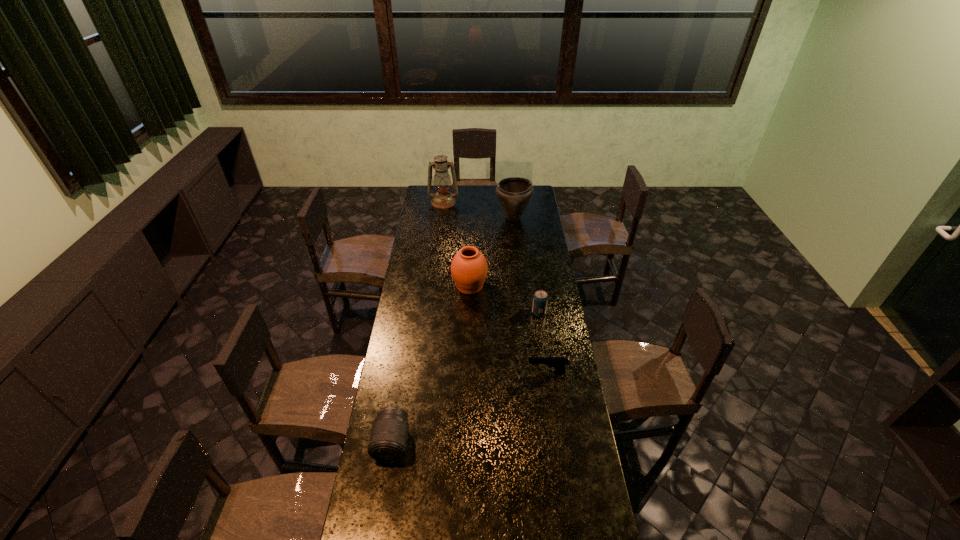
The height and width of the screenshot is (540, 960). Identify the location of pop soda that is at the right edge. (540, 299).

Where is `pistol located in the right edge section of the desktop`? pistol located in the right edge section of the desktop is located at coordinates (559, 363).

The image size is (960, 540). I want to click on object positioned at the far left corner, so click(443, 199).

You are a GUI agent. You are given a task and a screenshot of the screen. Output one action in this format:
    pyautogui.click(x=<x>, y=<y>)
    Task: Click on the vacant space at the far edge
    The image size is (960, 540).
    Given the screenshot: What is the action you would take?
    pyautogui.click(x=484, y=194)

The height and width of the screenshot is (540, 960). Identify the location of vacant area at the left edge of the desktop. (381, 408).

Find the location of `free space at the right edge of the desktop`. free space at the right edge of the desktop is located at coordinates (537, 210).

Where is `vacant space in between the tallest object and the nearest object`? vacant space in between the tallest object and the nearest object is located at coordinates (418, 322).

Where is `blank region between the second nearest object and the fourth nearest object`? This screenshot has height=540, width=960. blank region between the second nearest object and the fourth nearest object is located at coordinates (509, 329).

You are a GUI agent. You are given a task and a screenshot of the screen. Output one action in this format:
    pyautogui.click(x=<x>, y=<y>)
    Task: Click on the free space between the farther urn and the third farthest object
    The height and width of the screenshot is (540, 960).
    Given the screenshot: What is the action you would take?
    pyautogui.click(x=492, y=252)

The image size is (960, 540). In order to click on empty location between the tallest object and the fourth nearest object in this screenshot , I will do `click(457, 244)`.